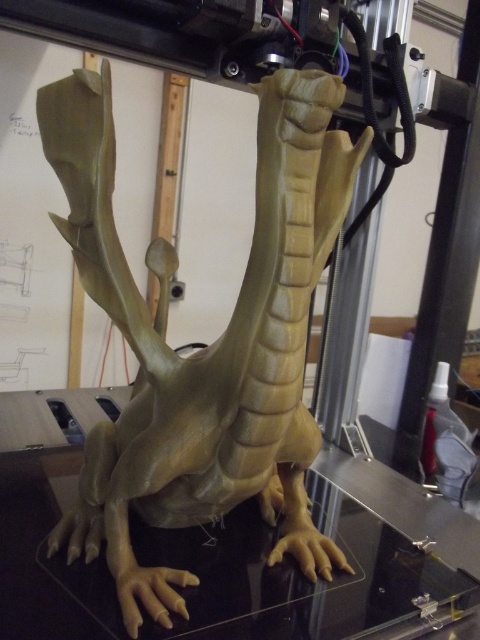
Question: Considering the relative positions of matte yellow dinosaur at center and transparent glass table at center in the image provided, where is matte yellow dinosaur at center located with respect to transparent glass table at center?

Choices:
 (A) right
 (B) left

Answer: (B)

Question: Does matte yellow dinosaur at center appear over transparent glass table at center?

Choices:
 (A) yes
 (B) no

Answer: (A)

Question: Among these objects, which one is nearest to the camera?

Choices:
 (A) matte yellow dinosaur at center
 (B) transparent glass table at center

Answer: (A)

Question: Is matte yellow dinosaur at center closer to the viewer compared to transparent glass table at center?

Choices:
 (A) no
 (B) yes

Answer: (B)

Question: Which of the following is the farthest from the observer?

Choices:
 (A) (22, 470)
 (B) (271, 552)

Answer: (A)

Question: Which object appears closest to the camera in this image?

Choices:
 (A) matte yellow dinosaur at center
 (B) transparent glass table at center

Answer: (A)